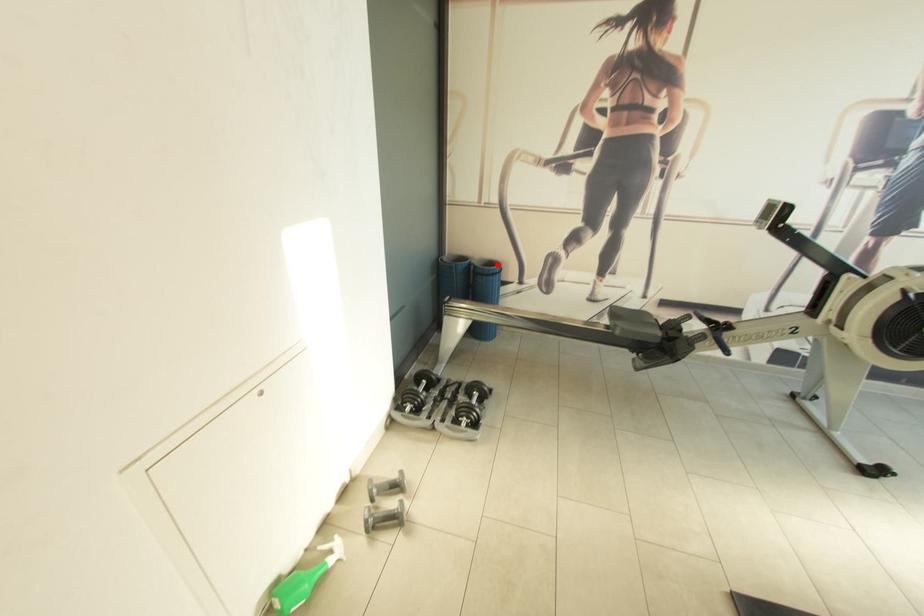
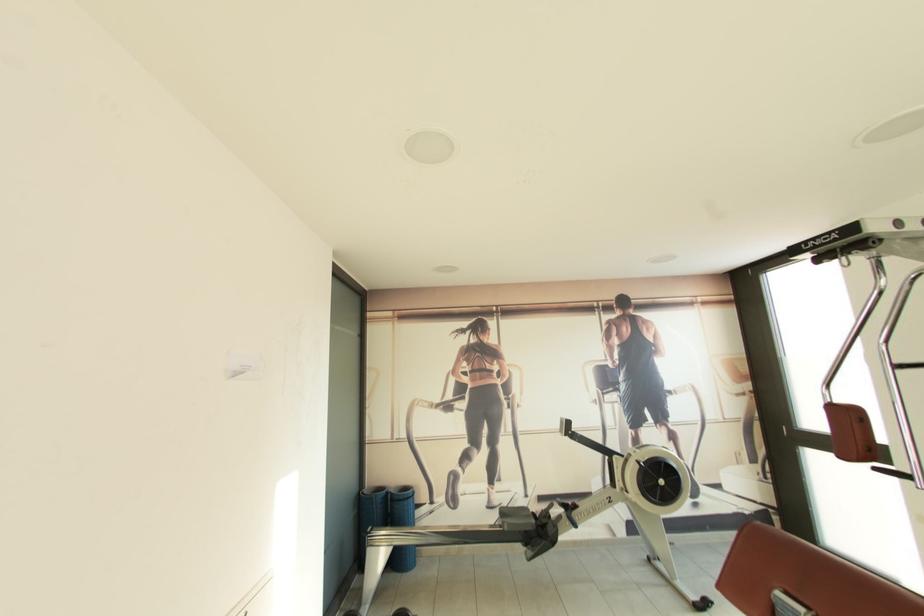
Locate, in the second image, the point that corresponds to the highlighted location in the first image.

(410, 490)